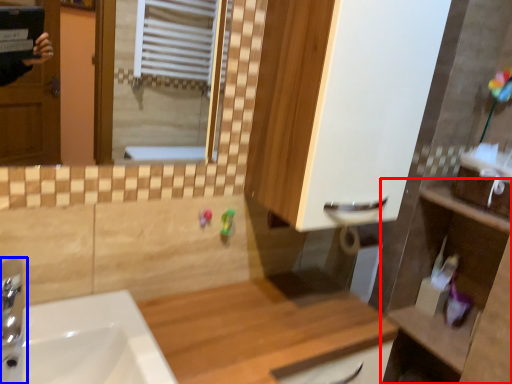
Question: Which object appears closest to the camera in this image, counter (highlighted by a red box) or tap (highlighted by a blue box)?

Choices:
 (A) counter
 (B) tap

Answer: (B)